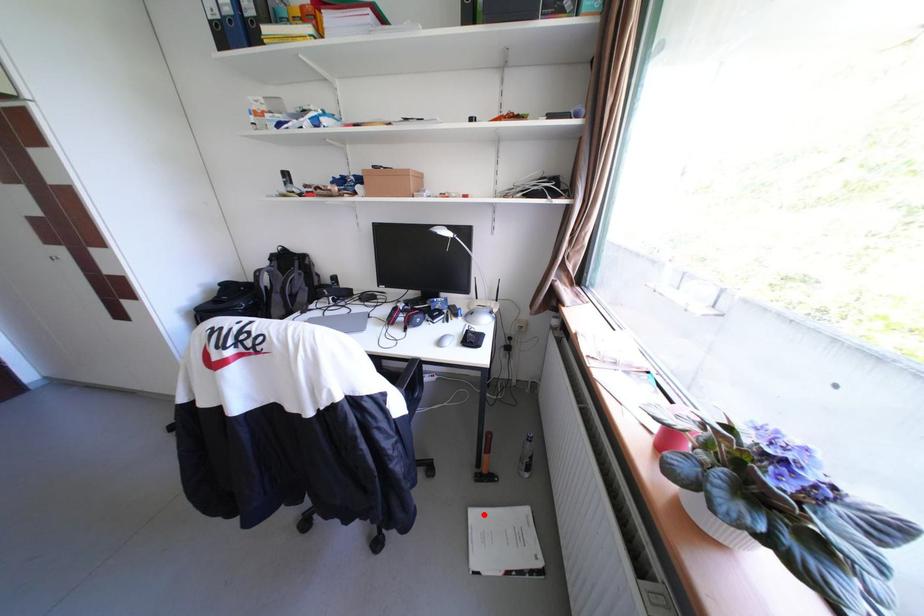
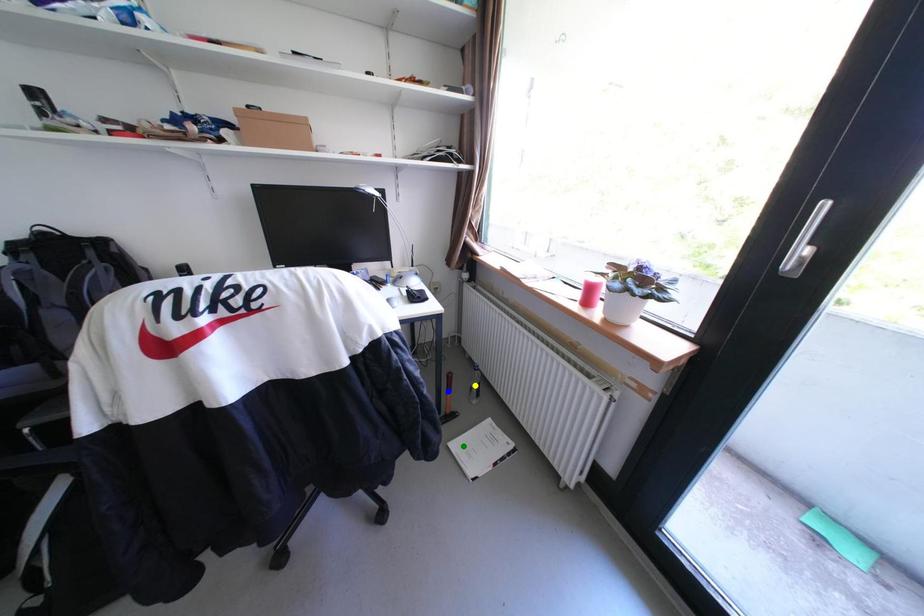
Question: I am providing you with two images of the same scene from different viewpoints. A red point is marked on the first image. You are given multiple points on the second image. Which point in image 2 is actually the same real-world point as the red point in image 1?

Choices:
 (A) blue point
 (B) green point
 (C) yellow point

Answer: (B)